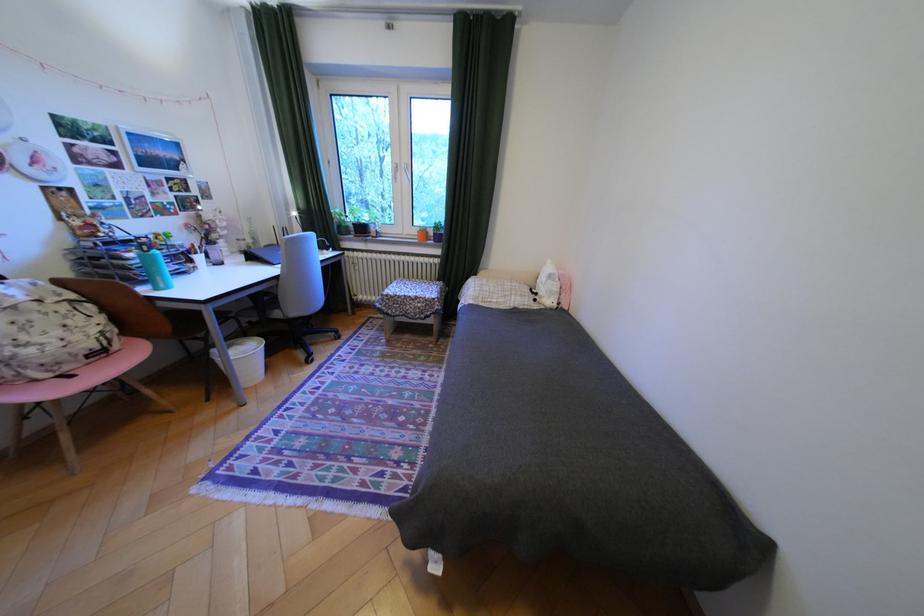
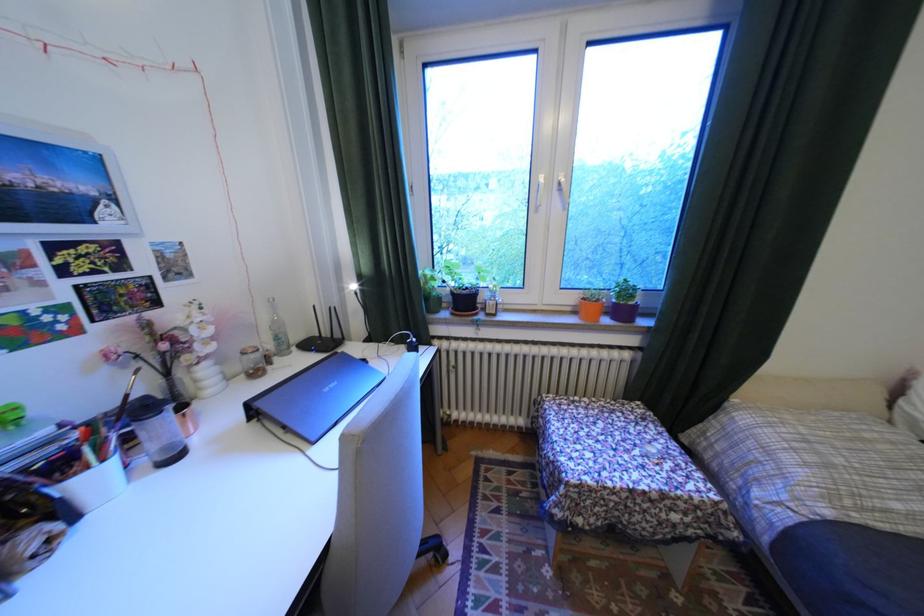
Find the pixel in the second image that matches point (417, 174) in the first image.

(566, 195)